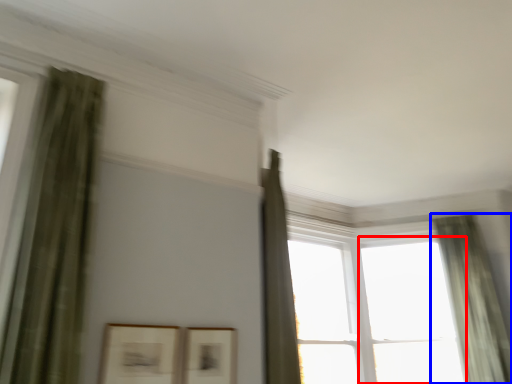
Question: Which object appears farthest to the camera in this image, window (highlighted by a red box) or curtain (highlighted by a blue box)?

Choices:
 (A) window
 (B) curtain

Answer: (A)